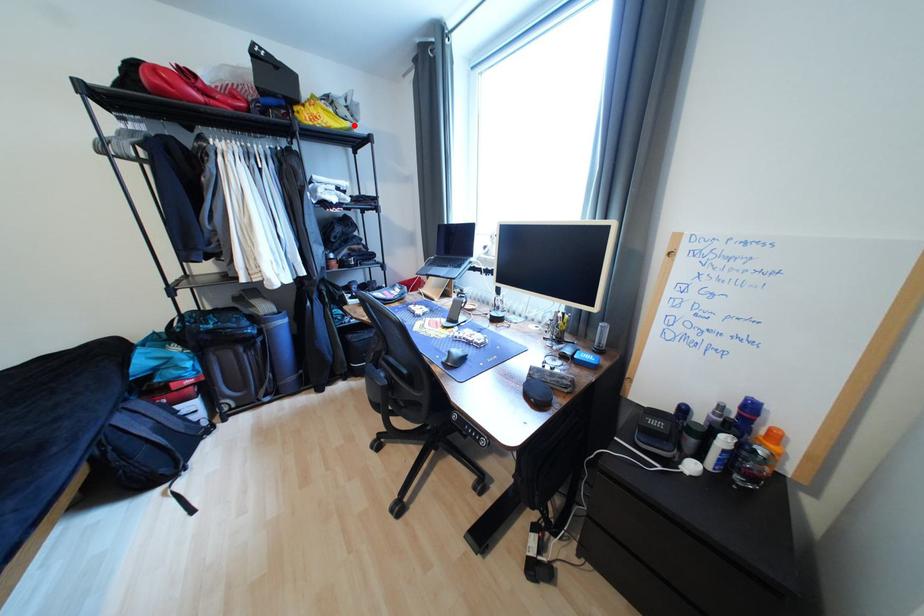
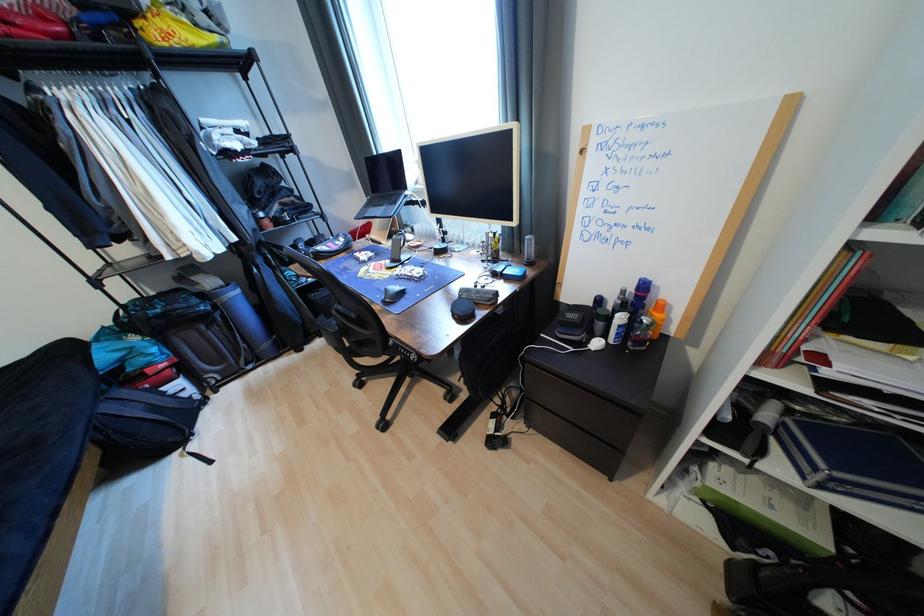
Question: I am providing you with two images of the same scene from different viewpoints. A red point is marked on the first image. At the location where the point appears in image 1, is it still visible in image 2?

Choices:
 (A) Yes
 (B) No

Answer: (A)